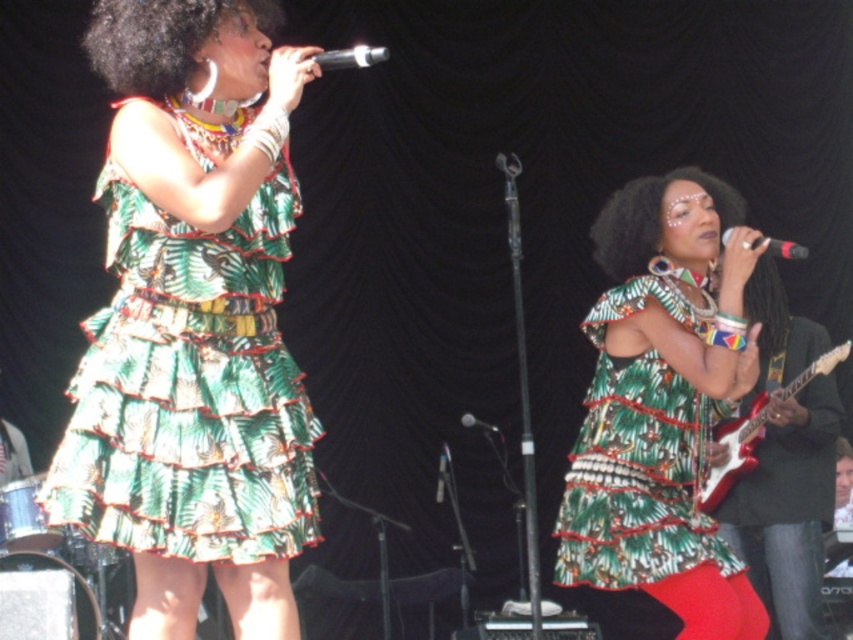
Which is behind, point (331, 58) or point (730, 230)?

Point (730, 230)

Find the location of a particular element. This screenshot has height=640, width=853. black plastic microphone at upper center is located at coordinates (351, 58).

Can you confirm if curly hair at upper left is positioned to the right of green textured fabric afro at center?

Incorrect, curly hair at upper left is not on the right side of green textured fabric afro at center.

Is point (271, 29) in front of point (625, 234)?

Yes, point (271, 29) is closer to viewer.

Locate an element on the screen. Image resolution: width=853 pixels, height=640 pixels. curly hair at upper left is located at coordinates (161, 38).

Is green printed dress at center above black metallic microphone at center?

Indeed, green printed dress at center is positioned over black metallic microphone at center.

Can you confirm if green printed dress at center is positioned to the right of black metallic microphone at center?

Correct, you'll find green printed dress at center to the right of black metallic microphone at center.

Does point (558, 568) come in front of point (473, 420)?

Yes, point (558, 568) is in front of point (473, 420).

The height and width of the screenshot is (640, 853). What are the coordinates of `green printed dress at center` in the screenshot? It's located at (662, 403).